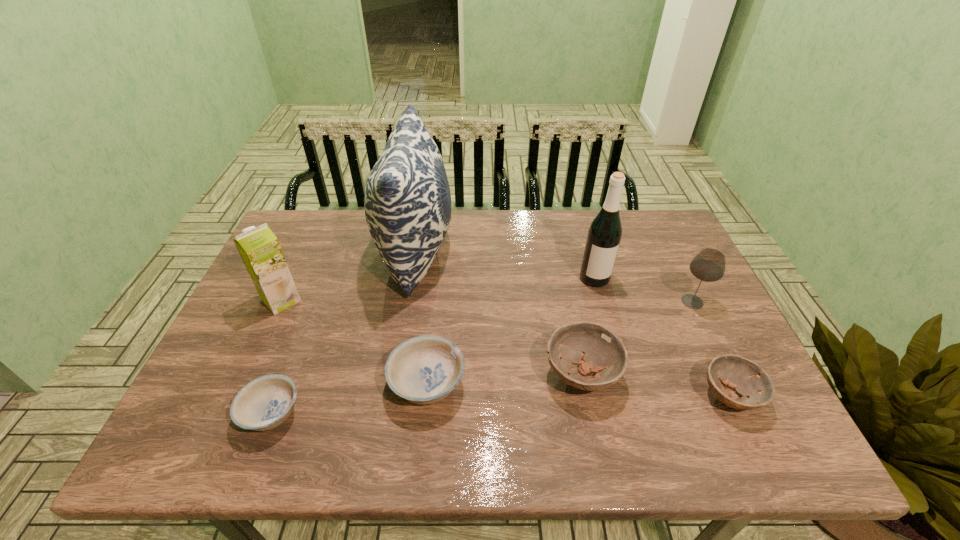
Find the location of `the smaller brown bowl`. the smaller brown bowl is located at coordinates pos(747,378).

This screenshot has height=540, width=960. I want to click on the right brown bowl, so coord(747,378).

Where is `the smaller blue bowl`? This screenshot has height=540, width=960. the smaller blue bowl is located at coordinates (x=264, y=403).

Identify the location of the shortest object. (264, 403).

Locate an element on the screen. The width and height of the screenshot is (960, 540). vacant position located 0.380m on the front surface of the cushion is located at coordinates (575, 252).

This screenshot has width=960, height=540. In order to click on free space located 0.280m on the label of the dark wine bottle in this screenshot , I will do `click(620, 371)`.

Locate an element on the screen. vacant area situated 0.300m on the back of the sixth shortest object is located at coordinates (316, 224).

This screenshot has height=540, width=960. Find the location of `vacant position located 0.230m on the left of the fourth tallest object`. vacant position located 0.230m on the left of the fourth tallest object is located at coordinates (593, 301).

Image resolution: width=960 pixels, height=540 pixels. Find the location of `vacant space located on the back of the fifth tallest object`. vacant space located on the back of the fifth tallest object is located at coordinates (562, 276).

At what (x,y) coordinates should I click in order to perform the action: click on vacant point located on the right of the bigger blue bowl. Please return your answer as a coordinate pair (x, y). This screenshot has width=960, height=540. Looking at the image, I should click on (608, 384).